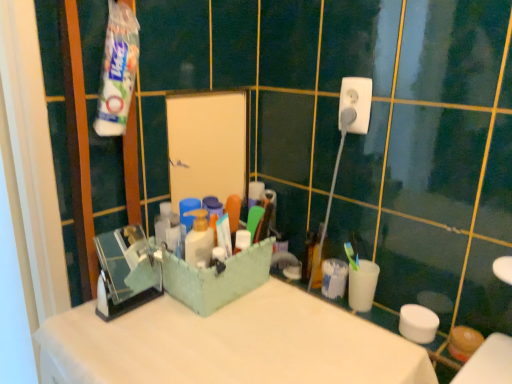
Question: Is white matte counter top at center next to white plastic socket at upper right?

Choices:
 (A) no
 (B) yes

Answer: (A)

Question: Is white matte counter top at center oriented away from white plastic socket at upper right?

Choices:
 (A) yes
 (B) no

Answer: (B)

Question: From the image's perspective, is white matte counter top at center on white plastic socket at upper right?

Choices:
 (A) yes
 (B) no

Answer: (B)

Question: Could you tell me if white matte counter top at center is facing white plastic socket at upper right?

Choices:
 (A) no
 (B) yes

Answer: (A)

Question: Does white matte counter top at center appear on the left side of white plastic socket at upper right?

Choices:
 (A) yes
 (B) no

Answer: (A)

Question: In the image, is white matte counter top at center positioned in front of or behind white plastic socket at upper right?

Choices:
 (A) behind
 (B) front

Answer: (B)

Question: Considering the positions of white matte counter top at center and white plastic socket at upper right in the image, is white matte counter top at center wider or thinner than white plastic socket at upper right?

Choices:
 (A) wide
 (B) thin

Answer: (A)

Question: Considering the positions of white matte counter top at center and white plastic socket at upper right in the image, is white matte counter top at center taller or shorter than white plastic socket at upper right?

Choices:
 (A) short
 (B) tall

Answer: (B)

Question: Is white matte counter top at center inside or outside of white plastic socket at upper right?

Choices:
 (A) outside
 (B) inside

Answer: (A)

Question: Looking at their shapes, would you say white plastic socket at upper right is wider or thinner than white matte counter top at center?

Choices:
 (A) thin
 (B) wide

Answer: (A)

Question: From the image's perspective, relative to white matte counter top at center, is white plastic socket at upper right above or below?

Choices:
 (A) above
 (B) below

Answer: (A)

Question: Visually, is white plastic socket at upper right positioned to the left or to the right of white matte counter top at center?

Choices:
 (A) right
 (B) left

Answer: (A)

Question: Is white plastic socket at upper right bigger or smaller than white matte counter top at center?

Choices:
 (A) small
 (B) big

Answer: (A)

Question: Relative to white plastic socket at upper right, is white plastic cup at right in front or behind?

Choices:
 (A) front
 (B) behind

Answer: (B)

Question: From their relative heights in the image, would you say white plastic cup at right is taller or shorter than white plastic socket at upper right?

Choices:
 (A) short
 (B) tall

Answer: (B)